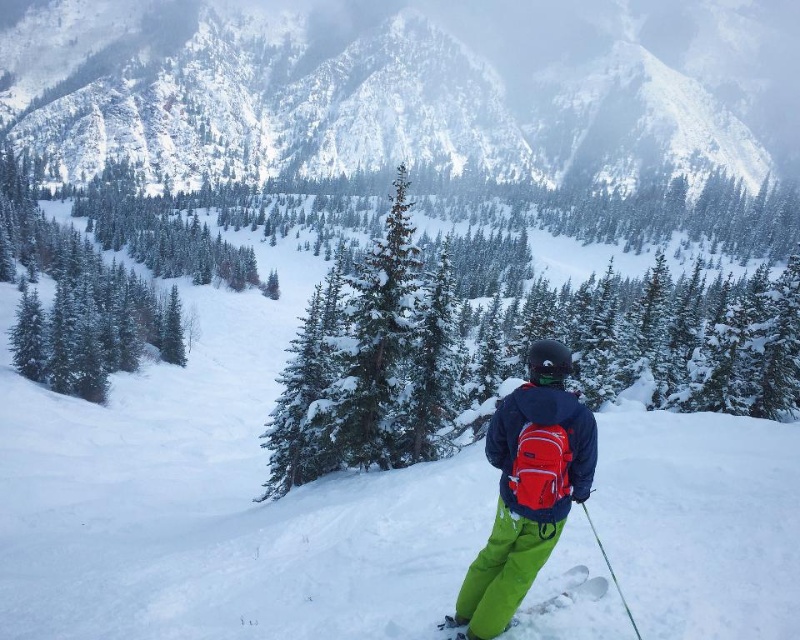
Question: Is snowy forested mountain at upper center positioned before white plastic ski at lower center?

Choices:
 (A) no
 (B) yes

Answer: (A)

Question: Does snowy forested mountain at upper center appear under white plastic ski at lower center?

Choices:
 (A) yes
 (B) no

Answer: (B)

Question: Considering the relative positions of green matte ski pants at center and white plastic ski at lower center in the image provided, where is green matte ski pants at center located with respect to white plastic ski at lower center?

Choices:
 (A) left
 (B) right

Answer: (A)

Question: Estimate the real-world distances between objects in this image. Which object is closer to the white plastic ski at lower center?

Choices:
 (A) green plastic ski pole at lower right
 (B) green matte ski pants at center
 (C) snowy forested mountain at upper center

Answer: (A)

Question: Which object is the closest to the green matte ski pants at center?

Choices:
 (A) green plastic ski pole at lower right
 (B) white plastic ski at lower center
 (C) snowy forested mountain at upper center

Answer: (A)

Question: Which object is closer to the camera taking this photo?

Choices:
 (A) white plastic ski at lower center
 (B) green plastic ski pole at lower right

Answer: (B)